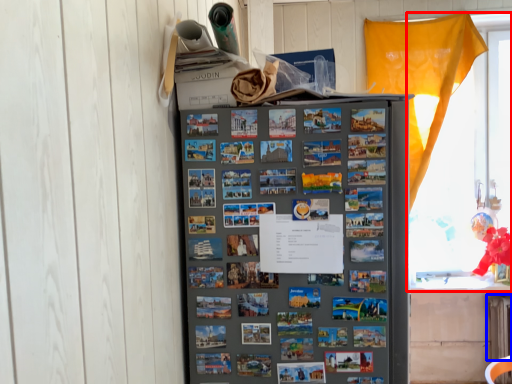
Question: Which object appears closest to the camera in this image, window (highlighted by a red box) or radiator (highlighted by a blue box)?

Choices:
 (A) window
 (B) radiator

Answer: (B)